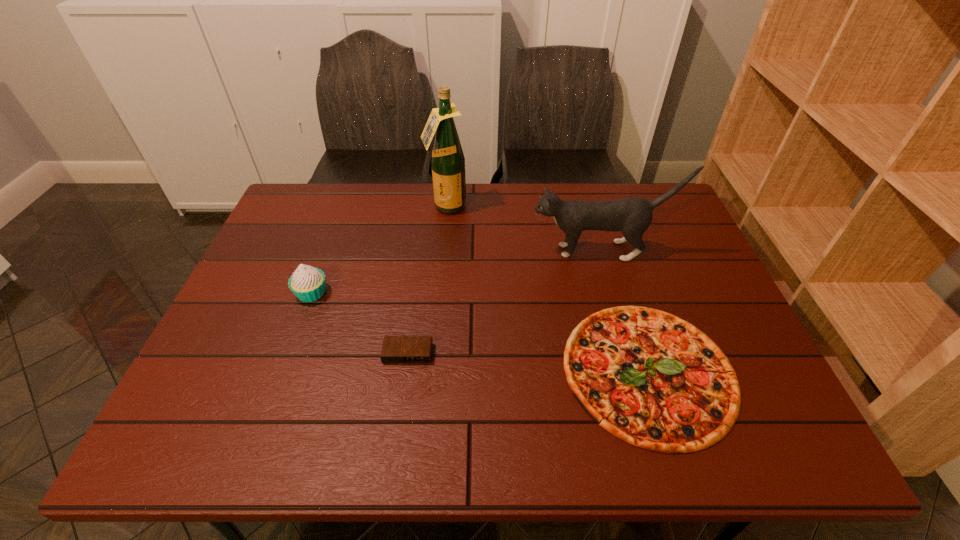
Locate an element on the screen. This screenshot has width=960, height=540. the tallest object is located at coordinates [x=447, y=160].

Where is `the farthest object`? the farthest object is located at coordinates (447, 160).

Locate an element on the screen. cat is located at coordinates (632, 216).

Find the location of `the fourth shortest object`. the fourth shortest object is located at coordinates (632, 216).

Find the location of a particular element. The image size is (960, 540). the third nearest object is located at coordinates (308, 284).

You are a GUI agent. You are given a task and a screenshot of the screen. Output one action in this format:
    pyautogui.click(x=<x>, y=<y>)
    Task: Click on the third tallest object
    The width and height of the screenshot is (960, 540).
    Given the screenshot: What is the action you would take?
    pyautogui.click(x=308, y=284)

Find the location of a particular element. Image resolution: width=960 pixels, height=540 pixels. alarm clock is located at coordinates (396, 349).

You are a GUI agent. You are given a task and a screenshot of the screen. Output one action in this format:
    pyautogui.click(x=<x>, y=<y>)
    Task: Click on the shortest object
    This screenshot has width=960, height=540.
    Given the screenshot: What is the action you would take?
    pyautogui.click(x=650, y=378)

Identify the location of vacant space located on the front-facing side of the tallest object. (439, 294).

Image resolution: width=960 pixels, height=540 pixels. I want to click on blank area located at the face of the second tallest object, so click(x=427, y=251).